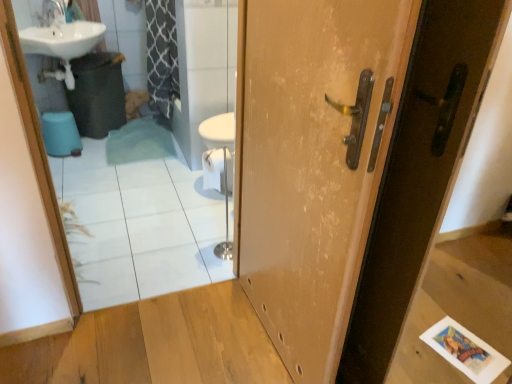
Question: Is wooden door at center at the right side of blue plastic toilet bowl at lower left?

Choices:
 (A) no
 (B) yes

Answer: (B)

Question: Can you confirm if wooden door at center is wider than blue plastic toilet bowl at lower left?

Choices:
 (A) no
 (B) yes

Answer: (A)

Question: Can you confirm if wooden door at center is bigger than blue plastic toilet bowl at lower left?

Choices:
 (A) no
 (B) yes

Answer: (B)

Question: From the image's perspective, would you say wooden door at center is shown under blue plastic toilet bowl at lower left?

Choices:
 (A) yes
 (B) no

Answer: (A)

Question: Is wooden door at center far from blue plastic toilet bowl at lower left?

Choices:
 (A) yes
 (B) no

Answer: (A)

Question: Is blue plastic toilet bowl at lower left in front of or behind white glossy mirror at upper left in the image?

Choices:
 (A) front
 (B) behind

Answer: (B)

Question: Does point (48, 117) appear closer or farther from the camera than point (197, 115)?

Choices:
 (A) closer
 (B) farther

Answer: (B)

Question: From a real-world perspective, relative to white glossy mirror at upper left, is blue plastic toilet bowl at lower left vertically above or below?

Choices:
 (A) above
 (B) below

Answer: (B)

Question: Looking at the image, does blue plastic toilet bowl at lower left seem bigger or smaller compared to white glossy mirror at upper left?

Choices:
 (A) small
 (B) big

Answer: (A)

Question: Considering the relative positions of white glossy mirror at upper left and wooden door at center in the image provided, is white glossy mirror at upper left to the left or to the right of wooden door at center?

Choices:
 (A) left
 (B) right

Answer: (A)

Question: Considering the positions of white glossy mirror at upper left and wooden door at center in the image, is white glossy mirror at upper left taller or shorter than wooden door at center?

Choices:
 (A) short
 (B) tall

Answer: (A)

Question: Is white glossy mirror at upper left bigger or smaller than wooden door at center?

Choices:
 (A) small
 (B) big

Answer: (A)

Question: Is point (89, 158) positioned closer to the camera than point (458, 29)?

Choices:
 (A) farther
 (B) closer

Answer: (A)

Question: From a real-world perspective, relative to blue plastic toilet bowl at lower left, is white glossy mirror at upper left vertically above or below?

Choices:
 (A) below
 (B) above

Answer: (B)

Question: Is white glossy mirror at upper left wider or thinner than blue plastic toilet bowl at lower left?

Choices:
 (A) thin
 (B) wide

Answer: (A)